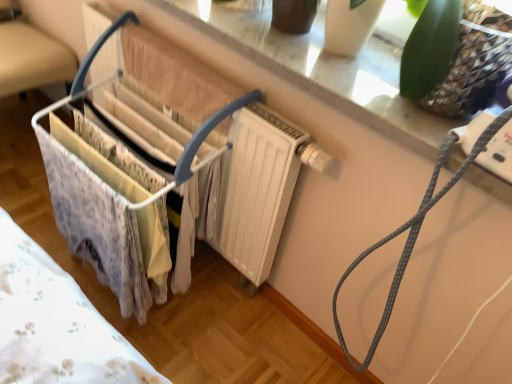
Question: Are white plastic baby carriage at left and gray dotted string at upper right far apart?

Choices:
 (A) no
 (B) yes

Answer: (A)

Question: From the image's perspective, is white plastic baby carriage at left beneath gray dotted string at upper right?

Choices:
 (A) no
 (B) yes

Answer: (A)

Question: Is white plastic baby carriage at left wider than gray dotted string at upper right?

Choices:
 (A) no
 (B) yes

Answer: (B)

Question: Could you tell me if white plastic baby carriage at left is facing gray dotted string at upper right?

Choices:
 (A) no
 (B) yes

Answer: (A)

Question: Can you confirm if white plastic baby carriage at left is taller than gray dotted string at upper right?

Choices:
 (A) yes
 (B) no

Answer: (B)

Question: From the image's perspective, is white plastic baby carriage at left located above or below gray dotted string at upper right?

Choices:
 (A) above
 (B) below

Answer: (A)

Question: In terms of width, does white plastic baby carriage at left look wider or thinner when compared to gray dotted string at upper right?

Choices:
 (A) wide
 (B) thin

Answer: (A)

Question: Relative to gray dotted string at upper right, is white plastic baby carriage at left in front or behind?

Choices:
 (A) behind
 (B) front

Answer: (A)

Question: Does point (150, 201) appear closer or farther from the camera than point (403, 256)?

Choices:
 (A) closer
 (B) farther

Answer: (B)

Question: Considering the positions of white glossy window sill at upper center and gray dotted string at upper right in the image, is white glossy window sill at upper center bigger or smaller than gray dotted string at upper right?

Choices:
 (A) small
 (B) big

Answer: (A)

Question: Is white glossy window sill at upper center to the left or to the right of gray dotted string at upper right in the image?

Choices:
 (A) right
 (B) left

Answer: (B)

Question: Is white glossy window sill at upper center in front of or behind gray dotted string at upper right in the image?

Choices:
 (A) behind
 (B) front

Answer: (A)

Question: Considering the positions of white glossy window sill at upper center and gray dotted string at upper right in the image, is white glossy window sill at upper center wider or thinner than gray dotted string at upper right?

Choices:
 (A) wide
 (B) thin

Answer: (B)

Question: Is metallic wire basket at left taller or shorter than white glossy window sill at upper center?

Choices:
 (A) short
 (B) tall

Answer: (B)

Question: From the image's perspective, is metallic wire basket at left located above or below white glossy window sill at upper center?

Choices:
 (A) below
 (B) above

Answer: (B)